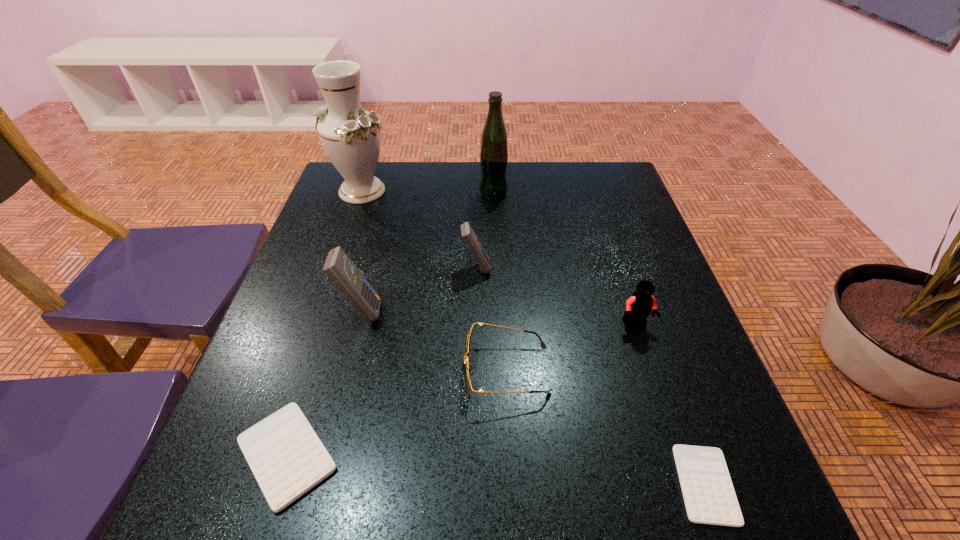
Locate an element on the screen. Image resolution: width=960 pixels, height=540 pixels. the third tallest calculator is located at coordinates 287,458.

Image resolution: width=960 pixels, height=540 pixels. I want to click on the left white calculator, so click(287, 458).

At what (x,y) coordinates should I click in order to perform the action: click on the smaller white calculator. Please return your answer as a coordinate pair (x, y). Looking at the image, I should click on (709, 496).

Locate an element on the screen. The width and height of the screenshot is (960, 540). the rightmost calculator is located at coordinates (709, 496).

Image resolution: width=960 pixels, height=540 pixels. Identify the location of vacant space positioned 0.190m on the right of the vase. (458, 191).

Image resolution: width=960 pixels, height=540 pixels. I want to click on free space located 0.160m on the left of the green beer bottle, so click(423, 193).

This screenshot has width=960, height=540. Identify the location of vacant space located on the front-facing side of the left blue calculator. (523, 312).

The width and height of the screenshot is (960, 540). Find the location of `vacant space located on the front-facing side of the third shortest calculator`. vacant space located on the front-facing side of the third shortest calculator is located at coordinates (636, 267).

Identify the location of free space located on the front-facing side of the Lego. This screenshot has height=540, width=960. (700, 519).

The width and height of the screenshot is (960, 540). In order to click on vacant space located 0.200m on the lenses of the black sunglasses in this screenshot , I will do `click(359, 370)`.